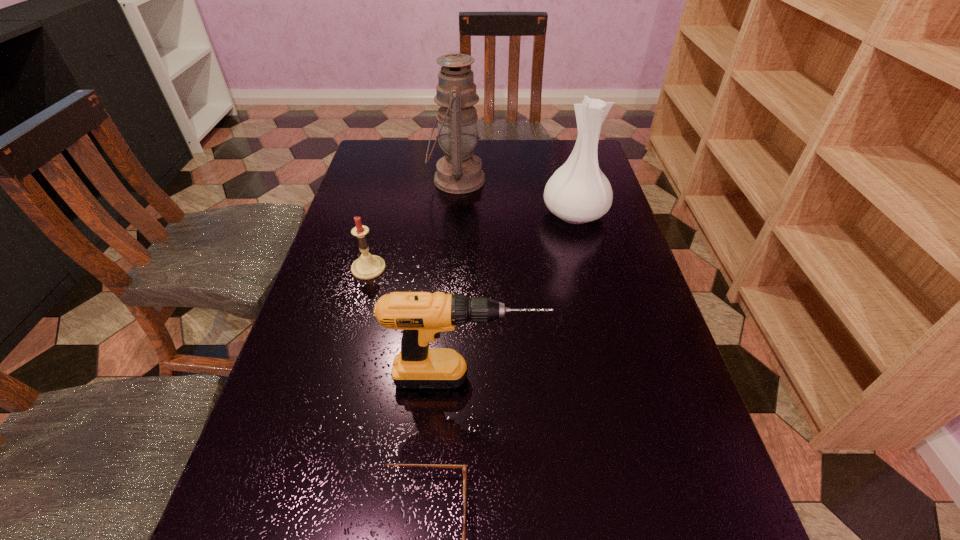
Locate an element on the screen. oil lamp is located at coordinates (459, 171).

Find the location of `the rightmost object`. the rightmost object is located at coordinates (578, 192).

Locate an element on the screen. The height and width of the screenshot is (540, 960). the fourth shortest object is located at coordinates (578, 192).

Find the location of `drill`. drill is located at coordinates (x=423, y=316).

Where is `the fourth farthest object`? The image size is (960, 540). the fourth farthest object is located at coordinates (423, 316).

The width and height of the screenshot is (960, 540). I want to click on the leftmost object, so click(x=368, y=266).

This screenshot has width=960, height=540. I want to click on the fourth tallest object, so click(x=368, y=266).

What are the coordinates of `free space located on the front of the tallest object` in the screenshot? It's located at (449, 282).

This screenshot has width=960, height=540. Identify the location of vacant space located 0.340m on the left of the vase. (420, 213).

Locate an element on the screen. This screenshot has width=960, height=540. vacant region located 0.140m at the tip of the third shortest object is located at coordinates (615, 378).